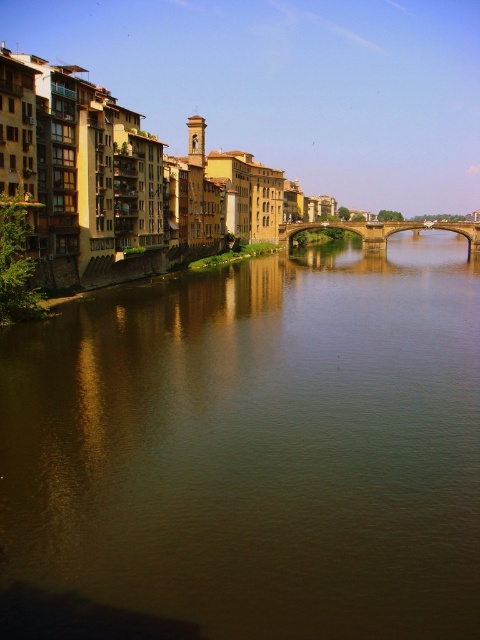
You are a tourist standing on the stone arch bridge at center. You want to take a photo of the brown reflective water at center. Which direction should you face to capture the water in your shot?

Since the brown reflective water at center is wider than the stone arch bridge at center, you should face towards the direction where the water spans wider to include as much of the reflective surface as possible in your photo.

You are a tourist standing on the stone arch bridge at center and want to take a photo of the brown reflective water at center. Is the water directly under the bridge, or is it somewhere else?

The brown reflective water at center is located below the stone arch bridge at center, so the water is directly under the bridge.

You are a tourist standing on the riverside path. You want to take a photo of the stone arch bridge at center without the brown reflective water at center appearing in the foreground. Is this possible?

The brown reflective water at center is in front of the stone arch bridge at center, so you cannot avoid the water appearing in the foreground of the bridge in the photo.